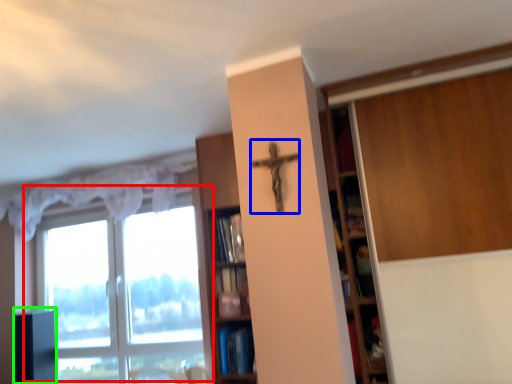
Question: Based on their relative distances, which object is nearer to window (highlighted by a red box)? Choose from crucifix (highlighted by a blue box) and cabinetry (highlighted by a green box).

Choices:
 (A) crucifix
 (B) cabinetry

Answer: (B)